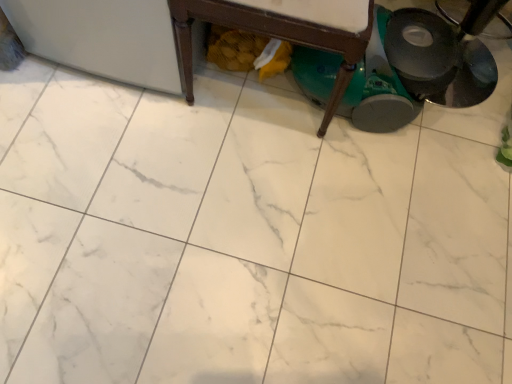
What do you see at coordinates (279, 33) in the screenshot? I see `wooden table at center` at bounding box center [279, 33].

You are a GUI agent. You are given a task and a screenshot of the screen. Output one action in this format:
    pyautogui.click(x=<x>, y=<y>)
    Task: Click on the wooden table at center
    The image size is (512, 384).
    Given the screenshot: What is the action you would take?
    pyautogui.click(x=279, y=33)

This screenshot has width=512, height=384. In order to click on wooden table at center in this screenshot , I will do `click(279, 33)`.